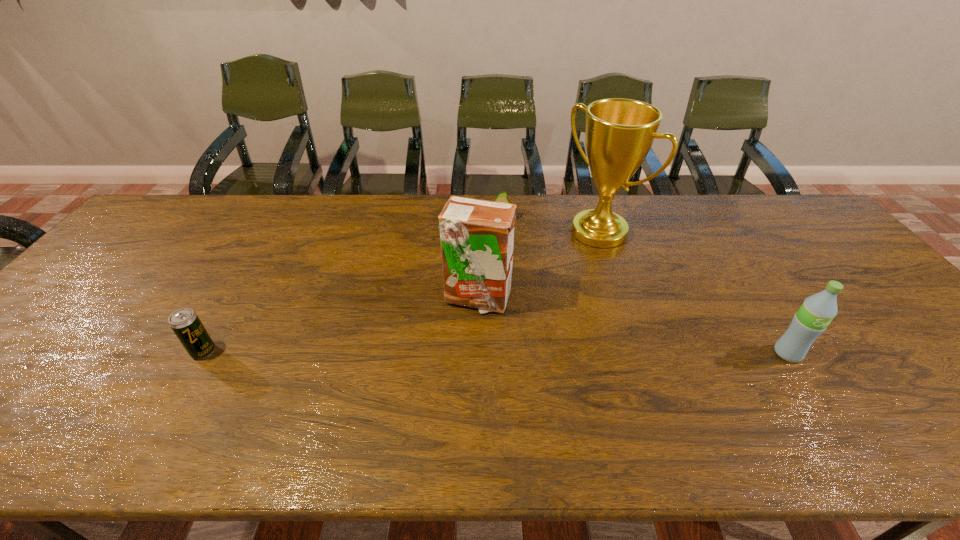
At what (x,y) coordinates should I click in order to perform the action: click on vacant space on the desktop that is between the leftmost object and the water bottle and is positioned on the cut side of the avocado. Please return your answer as a coordinate pair (x, y). This screenshot has width=960, height=540. Looking at the image, I should click on pyautogui.click(x=506, y=353).

In order to click on vacant space on the desktop that is between the beer can and the water bottle and is positioned by the handles of the award in this screenshot , I will do `click(425, 352)`.

In order to click on free space on the desktop that is between the beer can and the water bottle and is positioned on the straw side of the third nearest object in this screenshot , I will do `click(517, 353)`.